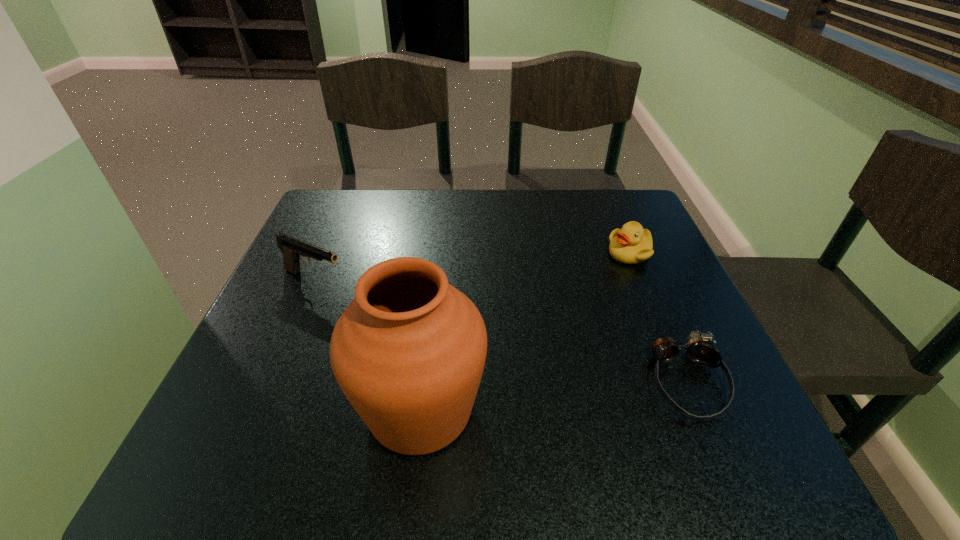
I want to click on unoccupied area between the goggles and the pistol, so [x=500, y=330].

Identify the location of unoccupied area between the third object from right to left and the second shortest object. This screenshot has height=540, width=960. pos(525,331).

I want to click on free space between the second tallest object and the shortest object, so click(500, 330).

You are a GUI agent. You are given a task and a screenshot of the screen. Output one action in this format:
    pyautogui.click(x=<x>, y=<y>)
    Task: Click on the third closest object to the leftmost object
    The image size is (960, 540).
    Given the screenshot: What is the action you would take?
    pyautogui.click(x=700, y=350)

The image size is (960, 540). I want to click on object that stands as the closest to the second object from left to right, so click(x=293, y=249).

You are a GUI agent. You are given a task and a screenshot of the screen. Output one action in this format:
    pyautogui.click(x=<x>, y=<y>)
    Task: Click on the free space that satisfies the following two spatial constraints: 1. on the back side of the duckling; 2. on the left side of the tallest object
    The width and height of the screenshot is (960, 540).
    Given the screenshot: What is the action you would take?
    coord(439,253)

You are a GUI agent. You are given a task and a screenshot of the screen. Output one action in this format:
    pyautogui.click(x=<x>, y=<y>)
    Task: Click on the free location that satisfies the following two spatial constraints: 1. on the front side of the second object from left to right; 2. on the right side of the second tallest object
    This screenshot has height=540, width=960.
    Given the screenshot: What is the action you would take?
    pyautogui.click(x=259, y=409)